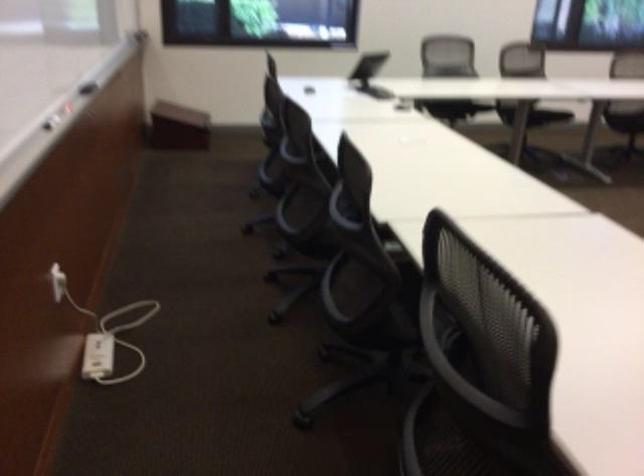
The image size is (644, 476). What are the coordinates of `brown wooden box` in the screenshot? It's located at (178, 127).